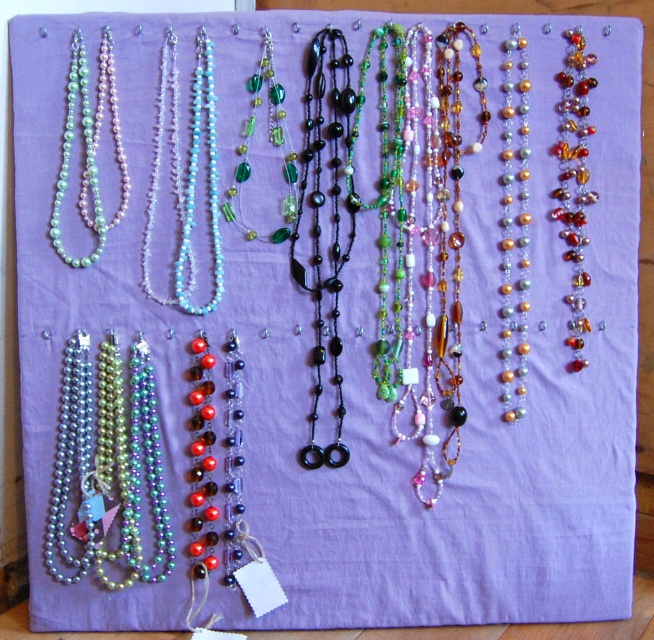
Question: Does metallic beads at center have a smaller size compared to black glass beads at center?

Choices:
 (A) no
 (B) yes

Answer: (B)

Question: Can you confirm if black glass beads at center is wider than pearl-like beads at center?

Choices:
 (A) yes
 (B) no

Answer: (A)

Question: Which object is closer to the camera taking this photo?

Choices:
 (A) translucent amber beads at upper right
 (B) black glass beads at center
 (C) pearl-like beads at center

Answer: (B)

Question: Which of the following is the closest to the observer?

Choices:
 (A) (504, 312)
 (B) (568, 68)

Answer: (B)

Question: Estimate the real-world distances between objects in this image. Which object is farther from the pearl-like beads at center?

Choices:
 (A) metallic beads at center
 (B) translucent amber beads at upper right
 (C) black glass beads at center
 (D) pearl-like beads at upper left

Answer: (A)

Question: Does pearl-like beads at center appear on the left side of pearl-like beads at upper left?

Choices:
 (A) no
 (B) yes

Answer: (A)